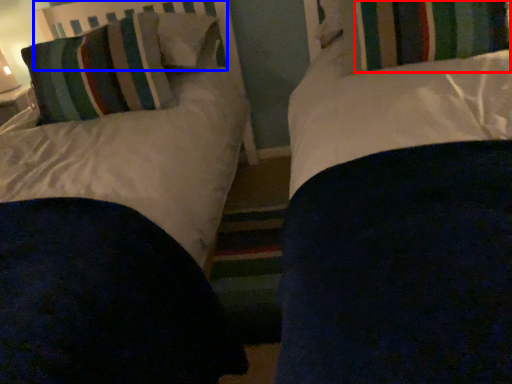
Question: Which point is further to the camera, curtain (highlighted by a red box) or headboard (highlighted by a blue box)?

Choices:
 (A) curtain
 (B) headboard

Answer: (B)